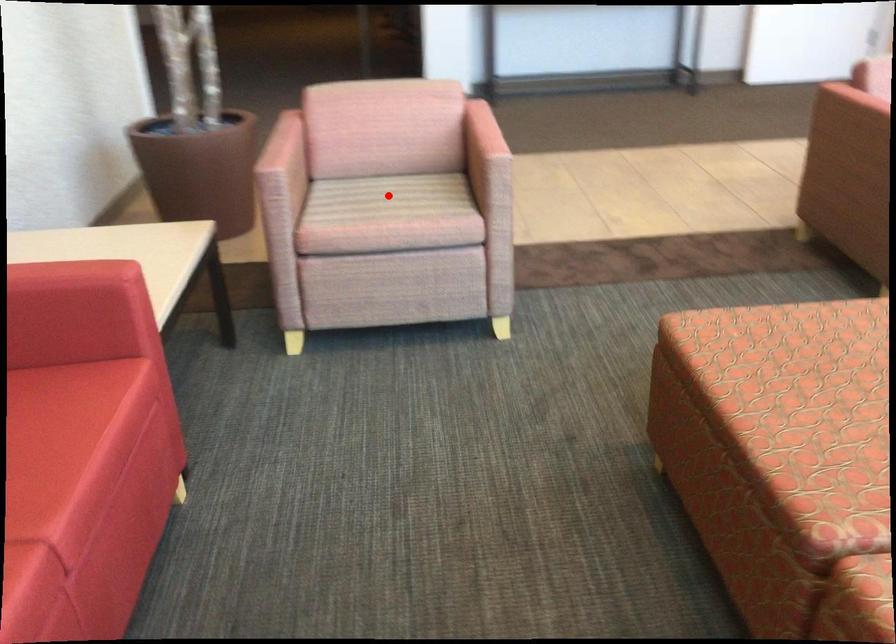
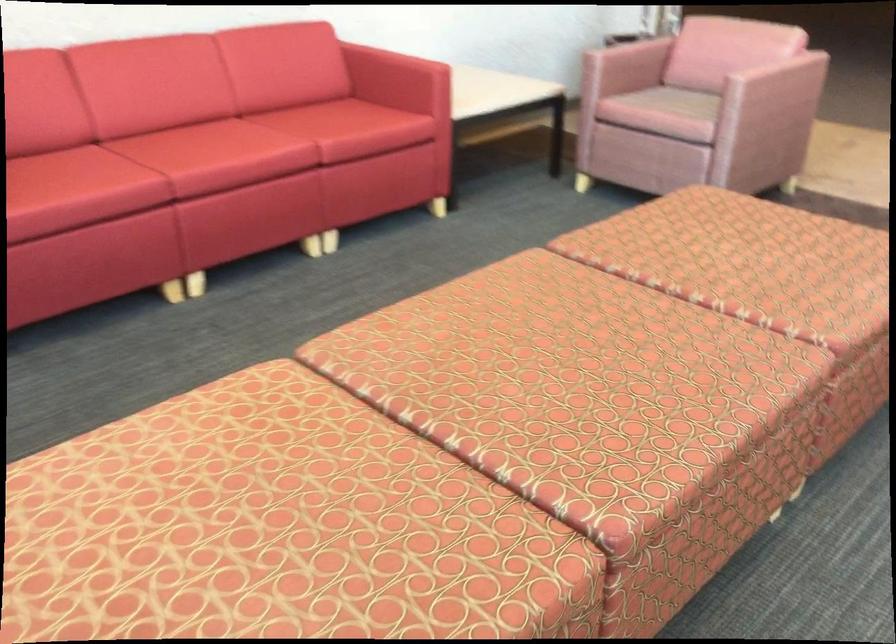
Where in the second image is the point corresponding to the highlighted location from the first image?

(686, 102)